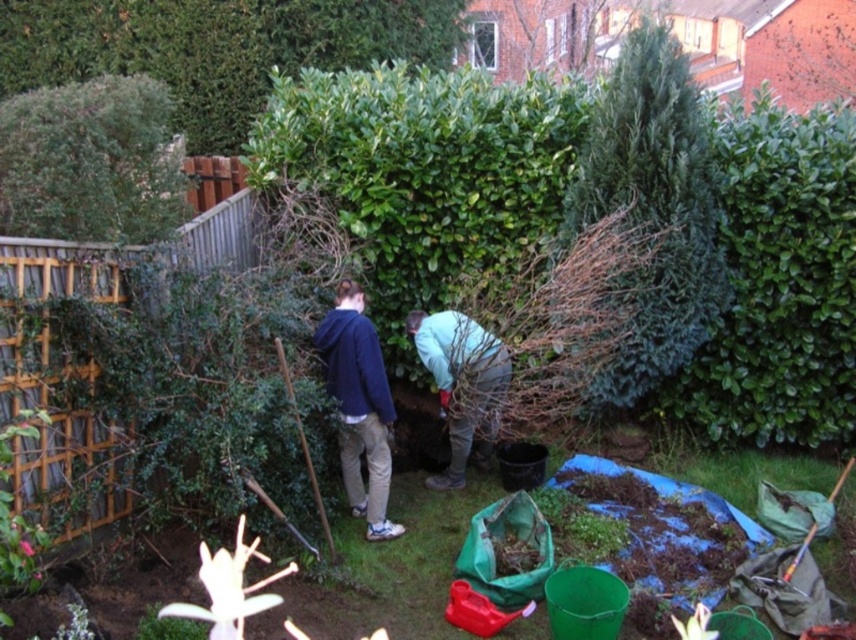
Question: Which point appears closest to the camera in this image?

Choices:
 (A) (432, 369)
 (B) (367, 490)

Answer: (B)

Question: Where is green textured tree at upper right located in relation to blue fleece jacket at center in the image?

Choices:
 (A) left
 (B) right

Answer: (B)

Question: Considering the relative positions of blue fleece jacket at center and light blue fabric at center in the image provided, where is blue fleece jacket at center located with respect to light blue fabric at center?

Choices:
 (A) left
 (B) right

Answer: (A)

Question: Which point appears farthest from the camera in this image?

Choices:
 (A) (461, 321)
 (B) (815, 438)
 (C) (67, 116)

Answer: (B)

Question: Can you confirm if green leafy hedge at upper right is positioned above light blue fabric at center?

Choices:
 (A) yes
 (B) no

Answer: (A)

Question: Among these objects, which one is nearest to the camera?

Choices:
 (A) light blue fabric at center
 (B) green leafy hedge at upper right
 (C) green leafy bush at upper center
 (D) green leafy bush at upper left

Answer: (D)